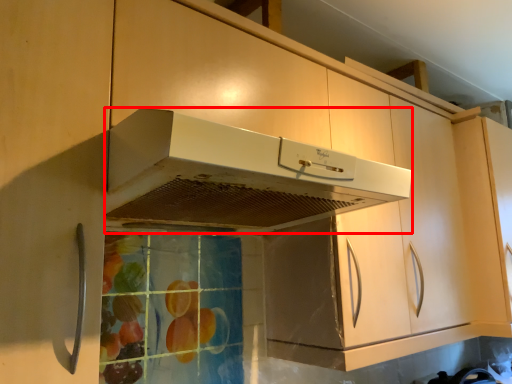
Question: Observing the image, what is the correct spatial positioning of home appliance (annotated by the red box) in reference to cabinetry?

Choices:
 (A) right
 (B) left

Answer: (B)